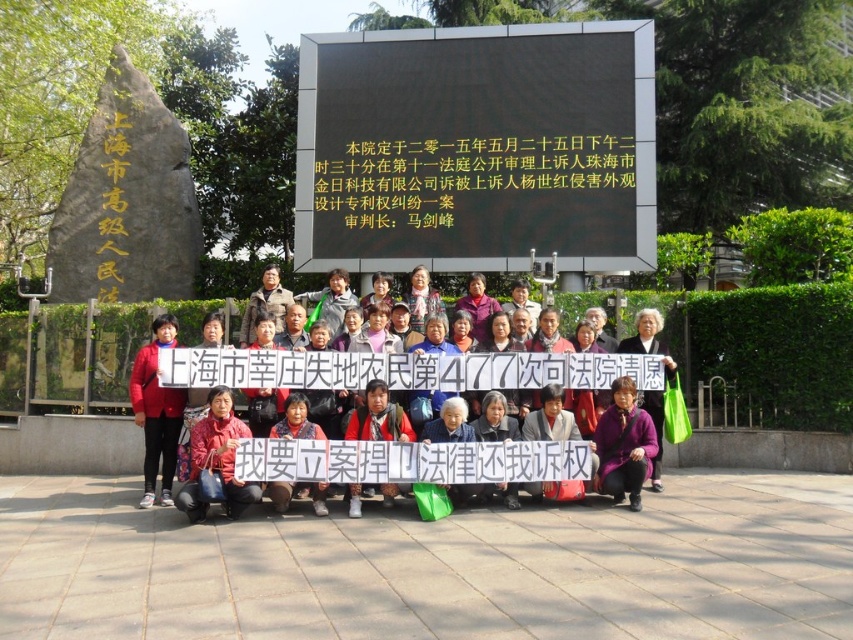
Question: Which point appears closest to the camera in this image?

Choices:
 (A) (486, 136)
 (B) (167, 420)
 (C) (605, 480)
 (D) (479, 144)

Answer: (C)

Question: Is yellow text on digital screen at upper center smaller than red matte jacket at center?

Choices:
 (A) no
 (B) yes

Answer: (A)

Question: Among these objects, which one is farthest from the camera?

Choices:
 (A) purple matte jacket at lower center
 (B) yellow text on digital screen at upper center
 (C) black matte sign at upper center

Answer: (B)

Question: Based on their relative distances, which object is nearer to the red matte jacket at center?

Choices:
 (A) red fabric jacket at lower center
 (B) purple matte jacket at lower center

Answer: (A)

Question: Is red matte jacket at center bigger than purple matte jacket at lower center?

Choices:
 (A) no
 (B) yes

Answer: (B)

Question: Does red fabric sign at center appear over red matte jacket at center?

Choices:
 (A) yes
 (B) no

Answer: (A)